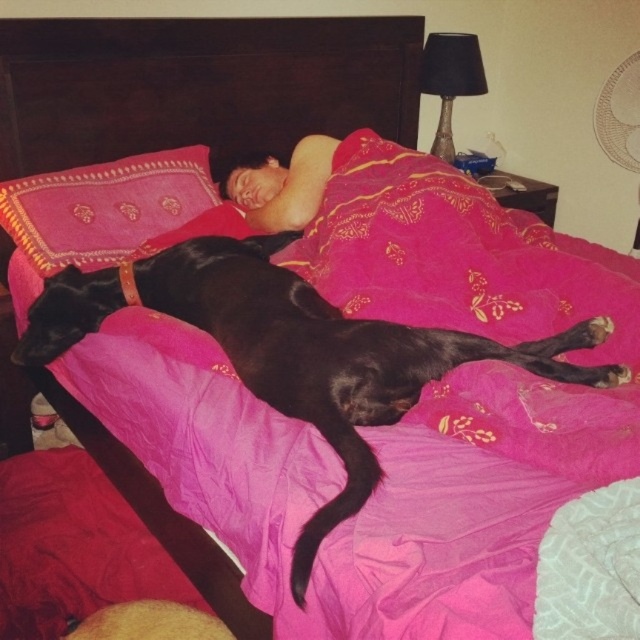
Based on the photo, between black smooth dog at center and pink embroidered pillow at upper left, which one has more height?

black smooth dog at center is taller.

Is black smooth dog at center above pink embroidered pillow at upper left?

Actually, black smooth dog at center is below pink embroidered pillow at upper left.

Find the location of `black smooth dog at center`. black smooth dog at center is located at coordinates (294, 349).

At what (x,y) coordinates should I click in order to perform the action: click on black smooth dog at center. Please return your answer as a coordinate pair (x, y). This screenshot has height=640, width=640. Looking at the image, I should click on (294, 349).

Does pink embroidered pillow at upper left come behind smooth skin person at center?

No, pink embroidered pillow at upper left is in front of smooth skin person at center.

Is pink embroidered pillow at upper left to the right of smooth skin person at center from the viewer's perspective?

Incorrect, pink embroidered pillow at upper left is not on the right side of smooth skin person at center.

Is point (52, 272) in front of point (276, 198)?

That is True.

At what (x,y) coordinates should I click in order to perform the action: click on pink embroidered pillow at upper left. Please return your answer as a coordinate pair (x, y). The image size is (640, 640). Looking at the image, I should click on (104, 205).

Can you confirm if black smooth dog at center is positioned to the right of smooth skin person at center?

Incorrect, black smooth dog at center is not on the right side of smooth skin person at center.

Is point (96, 328) in front of point (308, 216)?

Yes.

Is point (298, 384) positioned behind point (316, 205)?

No.

The height and width of the screenshot is (640, 640). Identify the location of black smooth dog at center. (294, 349).